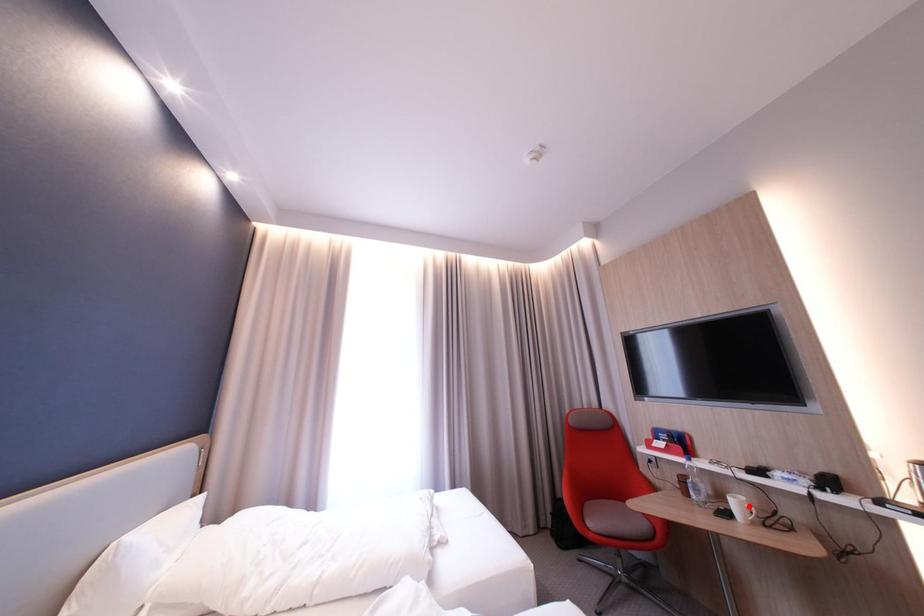
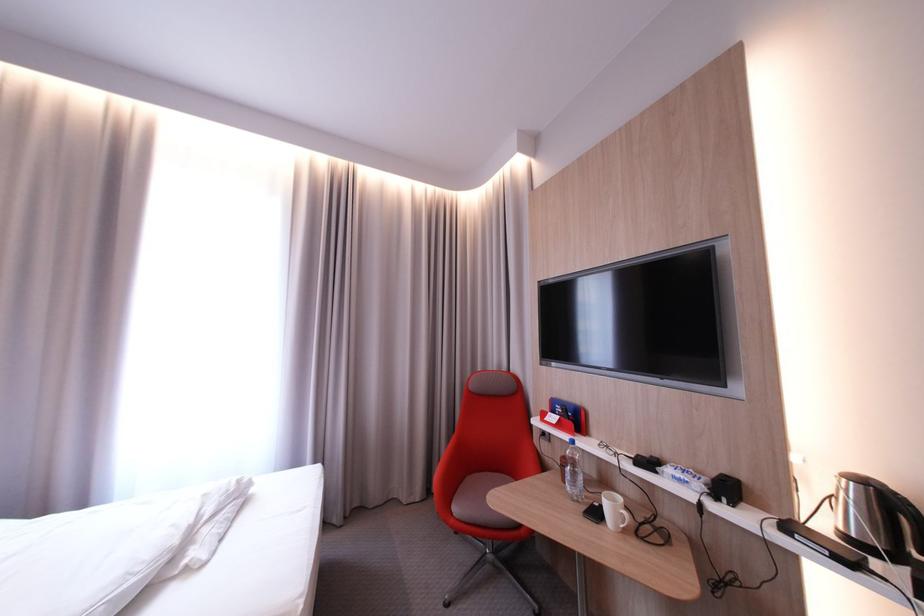
Question: I am providing you with two images of the same scene from different viewpoints. A red point is marked on the first image. Is the red point's position out of view in image 2?

Choices:
 (A) Yes
 (B) No

Answer: (B)